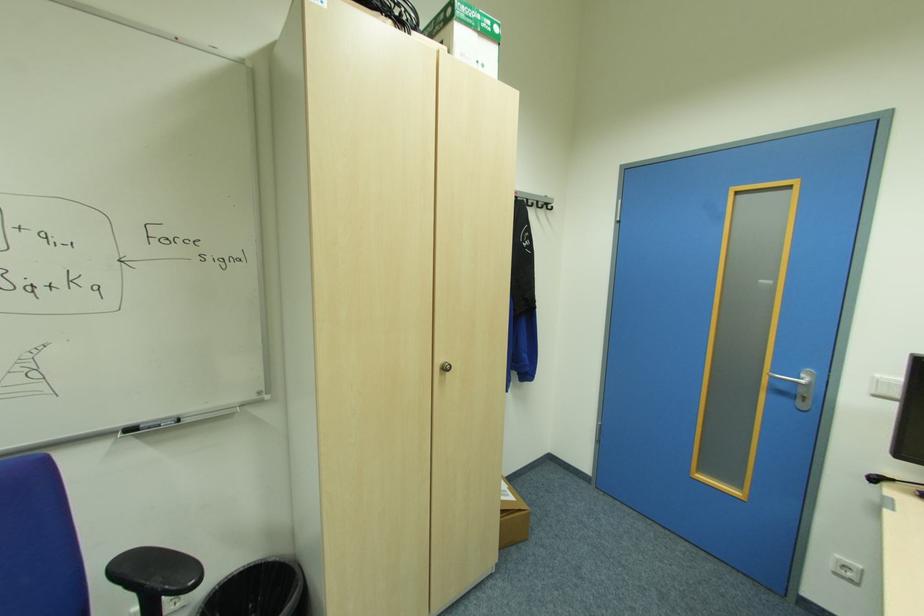
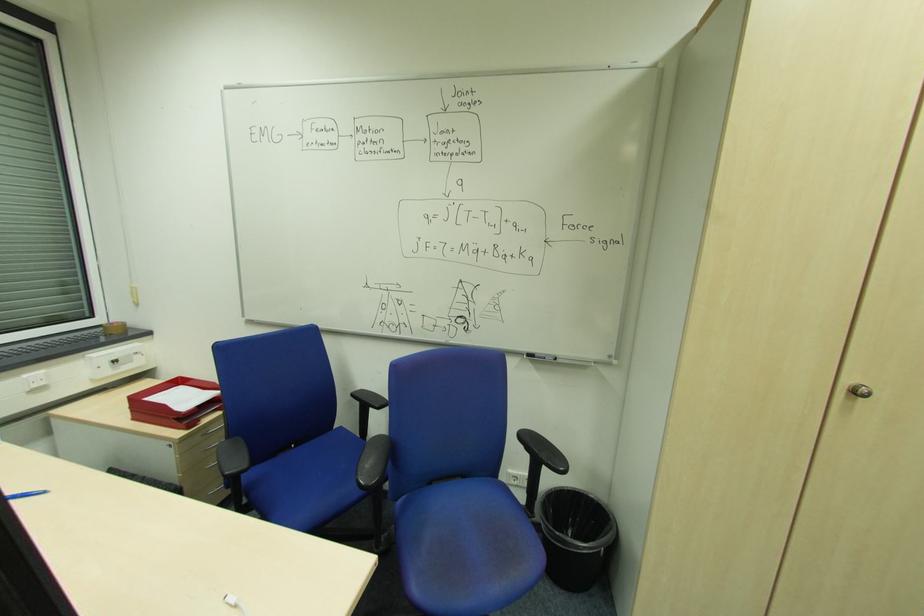
Where in the second image is the point corresponding to (447,368) from the first image?

(860, 392)